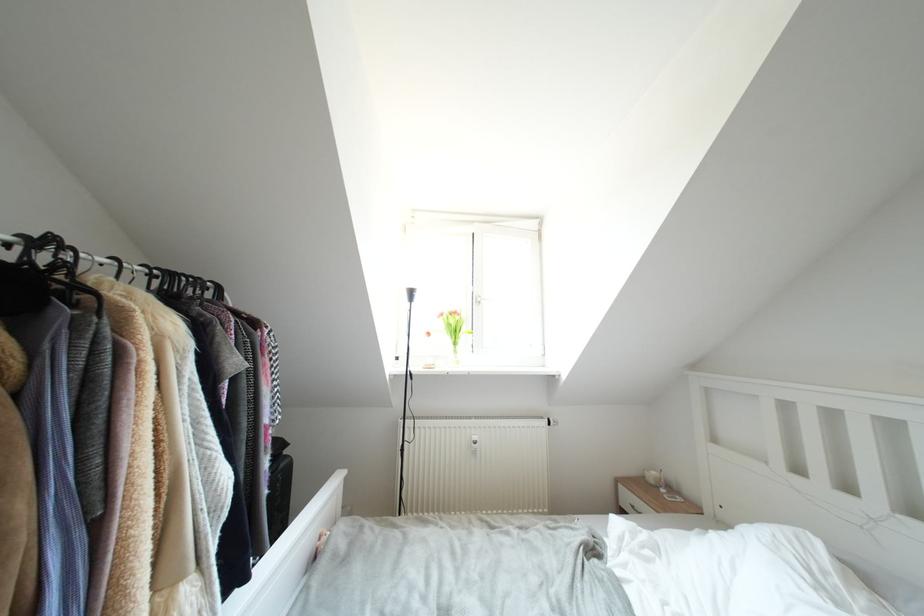
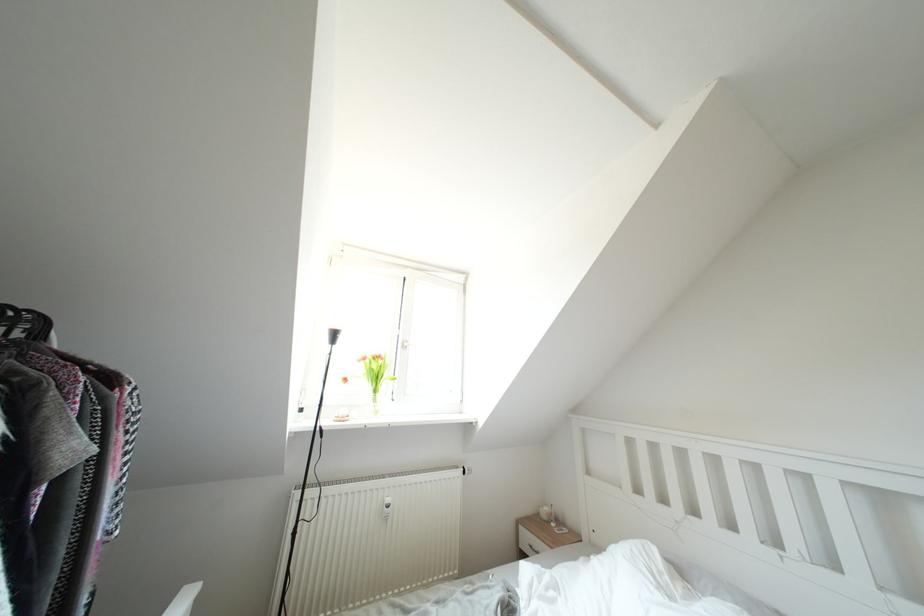
Where in the second image is the point corresponding to (657,485) from the first image?

(550, 522)